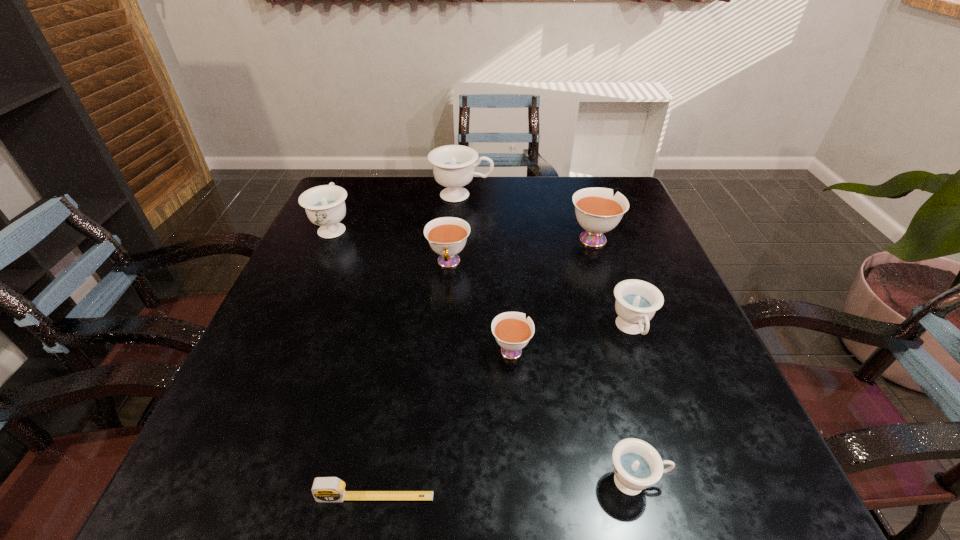
The width and height of the screenshot is (960, 540). What are the coordinates of `the closest white teacup to the leftmost white teacup` in the screenshot? It's located at (512, 331).

At what (x,y) coordinates should I click in order to perform the action: click on vacant space that satisfies the following two spatial constraints: 1. on the side of the farthest teacup with the handle; 2. at the front of the tape measure with the tape extended. Please return your answer as a coordinate pair (x, y). This screenshot has width=960, height=540. Looking at the image, I should click on (444, 497).

Find the location of a particular element. The image size is (960, 540). vacant point that satisfies the following two spatial constraints: 1. on the side of the farthest object with the handle; 2. on the side of the second biggest white teacup with the handle is located at coordinates (458, 263).

Where is `free space that satisfies the following two spatial constraints: 1. on the side of the second blue teacup from left to right with the handle; 2. on the side of the rightmost white teacup with the handle`? free space that satisfies the following two spatial constraints: 1. on the side of the second blue teacup from left to right with the handle; 2. on the side of the rightmost white teacup with the handle is located at coordinates pos(460,238).

Where is `vacant area in the image that satisfies the following two spatial constraints: 1. on the side of the second blue teacup from left to right with the handle; 2. on the side of the smallest white teacup with the handle`? This screenshot has width=960, height=540. vacant area in the image that satisfies the following two spatial constraints: 1. on the side of the second blue teacup from left to right with the handle; 2. on the side of the smallest white teacup with the handle is located at coordinates (453, 349).